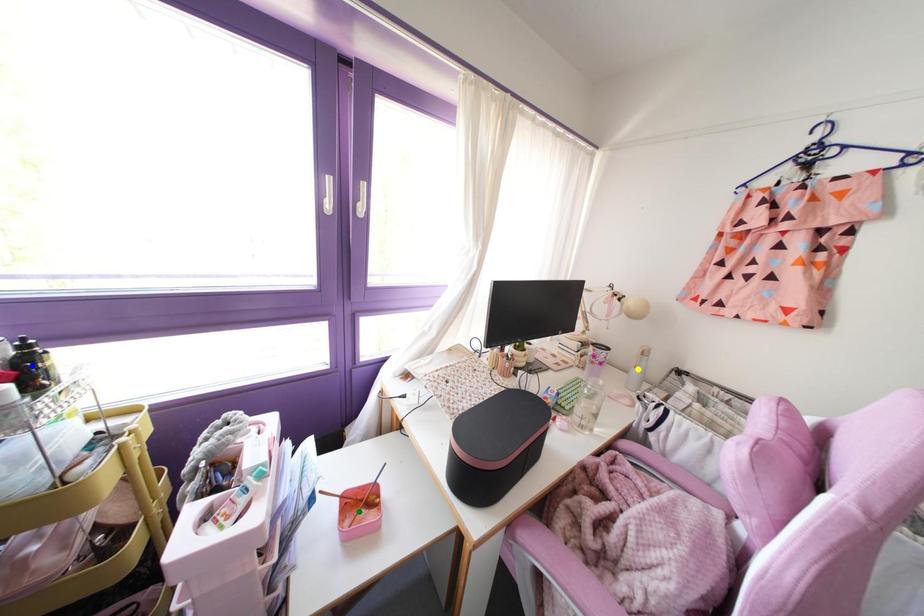
Order these from nearest to farthest:
blue point, green point, yellow point

1. yellow point
2. green point
3. blue point